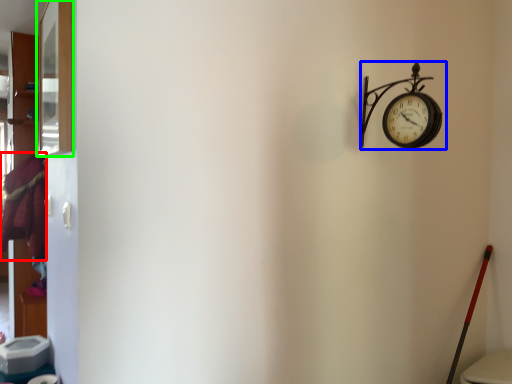
Question: Based on their relative distances, which object is farther from laundry (highlighted by a red box)? Choose from wall clock (highlighted by a blue box) and window (highlighted by a green box).

Choices:
 (A) wall clock
 (B) window

Answer: (A)